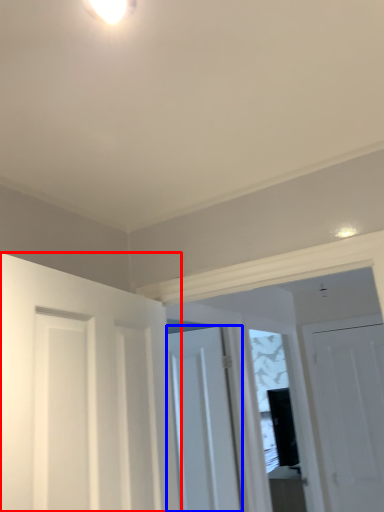
Question: Which point is closer to the camera, door (highlighted by a red box) or door (highlighted by a blue box)?

Choices:
 (A) door
 (B) door

Answer: (A)